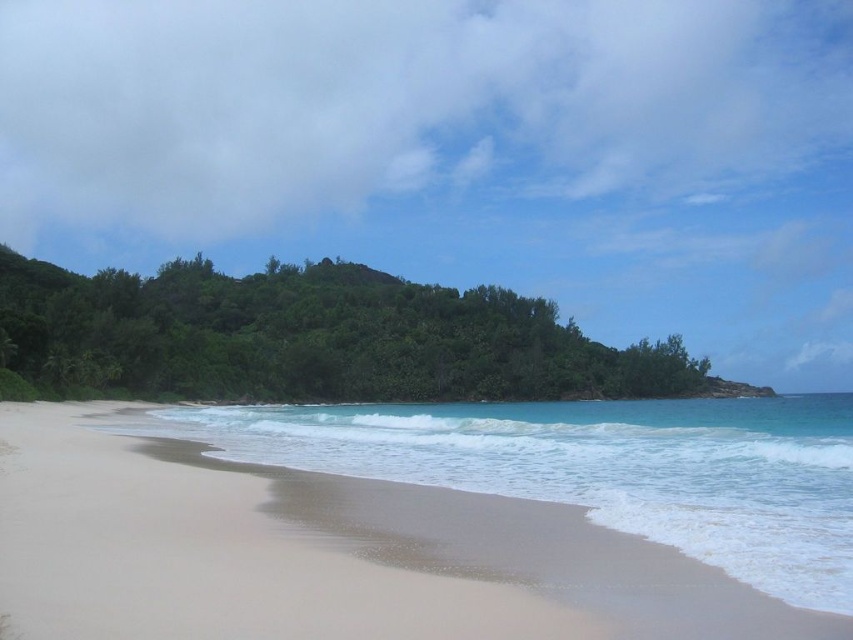
Is green leafy island at center closer to the viewer compared to clear blue water at lower center?

That is False.

Between point (33, 308) and point (717, 518), which one is positioned in front?

Point (717, 518) is more forward.

Is point (86, 392) positioned after point (372, 444)?

Yes, point (86, 392) is farther from viewer.

Find the location of a particular element. The width and height of the screenshot is (853, 640). green leafy island at center is located at coordinates (314, 339).